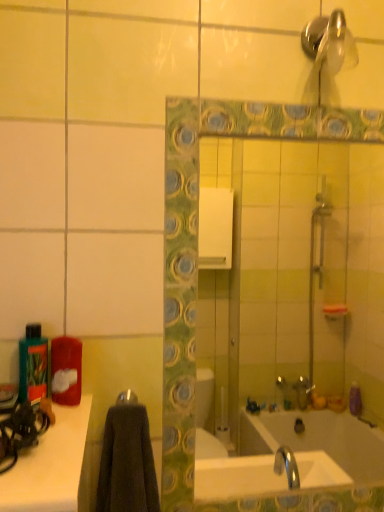
Question: Is green matte bottle at left completely or partially inside metallic silver towel bar at center?

Choices:
 (A) no
 (B) yes

Answer: (A)

Question: Can you confirm if metallic silver towel bar at center is smaller than green matte bottle at left?

Choices:
 (A) yes
 (B) no

Answer: (A)

Question: Considering the relative sizes of metallic silver towel bar at center and green matte bottle at left in the image provided, is metallic silver towel bar at center wider than green matte bottle at left?

Choices:
 (A) yes
 (B) no

Answer: (B)

Question: Is the position of metallic silver towel bar at center less distant than that of green matte bottle at left?

Choices:
 (A) no
 (B) yes

Answer: (A)

Question: Is metallic silver towel bar at center to the right of green matte bottle at left from the viewer's perspective?

Choices:
 (A) no
 (B) yes

Answer: (B)

Question: From the image's perspective, is shiny metallic shower head at upper right positioned above or below green mosaic tile mirror at center?

Choices:
 (A) below
 (B) above

Answer: (B)

Question: Considering the positions of shiny metallic shower head at upper right and green mosaic tile mirror at center in the image, is shiny metallic shower head at upper right bigger or smaller than green mosaic tile mirror at center?

Choices:
 (A) big
 (B) small

Answer: (B)

Question: From a real-world perspective, is shiny metallic shower head at upper right above or below green mosaic tile mirror at center?

Choices:
 (A) below
 (B) above

Answer: (B)

Question: Visually, is shiny metallic shower head at upper right positioned to the left or to the right of green mosaic tile mirror at center?

Choices:
 (A) left
 (B) right

Answer: (B)

Question: Considering the positions of green mosaic tile mirror at center and shiny metallic shower head at upper right in the image, is green mosaic tile mirror at center taller or shorter than shiny metallic shower head at upper right?

Choices:
 (A) short
 (B) tall

Answer: (B)

Question: Considering the positions of green mosaic tile mirror at center and shiny metallic shower head at upper right in the image, is green mosaic tile mirror at center wider or thinner than shiny metallic shower head at upper right?

Choices:
 (A) wide
 (B) thin

Answer: (B)

Question: Considering the positions of point (251, 420) and point (329, 56), is point (251, 420) closer or farther from the camera than point (329, 56)?

Choices:
 (A) closer
 (B) farther

Answer: (B)

Question: Considering the positions of green mosaic tile mirror at center and shiny metallic shower head at upper right in the image, is green mosaic tile mirror at center bigger or smaller than shiny metallic shower head at upper right?

Choices:
 (A) small
 (B) big

Answer: (B)

Question: Looking at their shapes, would you say green mosaic tile mirror at center is wider or thinner than green matte bottle at left?

Choices:
 (A) wide
 (B) thin

Answer: (B)

Question: In terms of height, does green mosaic tile mirror at center look taller or shorter compared to green matte bottle at left?

Choices:
 (A) tall
 (B) short

Answer: (A)